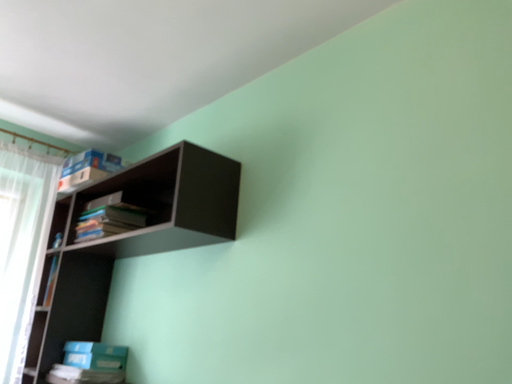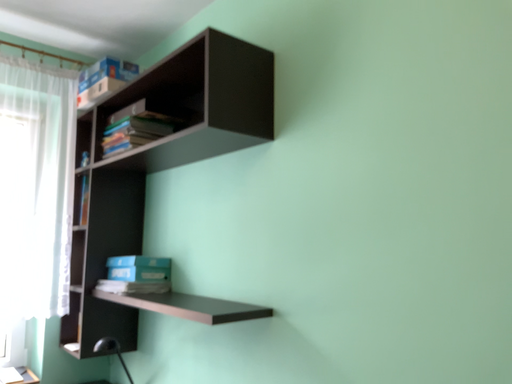
Question: Which way did the camera rotate in the video?

Choices:
 (A) rotated upward
 (B) rotated downward

Answer: (B)